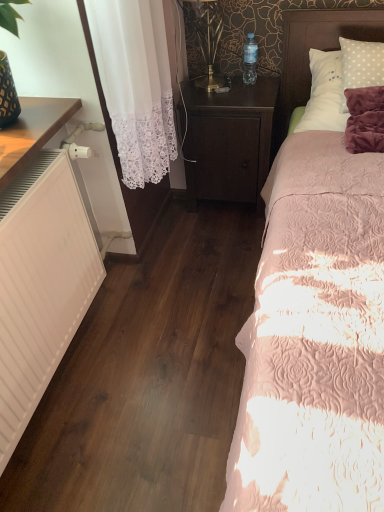
Find the location of a particular element. The image size is (384, 512). vacant space in front of transparent plastic bottle at upper center is located at coordinates pyautogui.click(x=250, y=88).